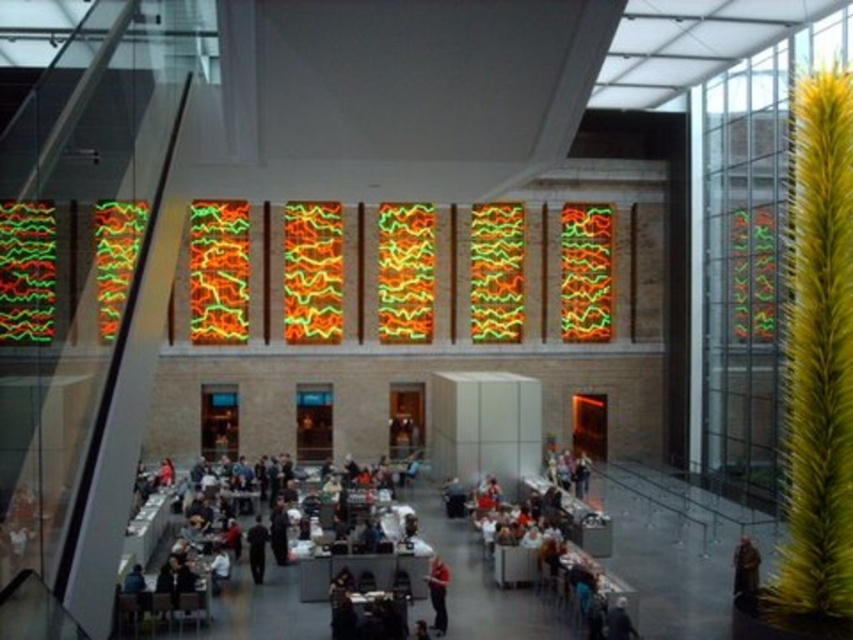
You are a fashion designer observing the indoor atrium scene. You notice a matte orange shirt at center and a dark blue fabric at center. Which object is smaller in size?

The matte orange shirt at center is smaller in size compared to the dark blue fabric at center.

You are standing in the atrium and need to find the dark gray suit at center. According to the layout, where would you look relative to the seven vertical panels?

The dark gray suit at center is located at point coordinates relative to the seven vertical panels, but since the exact spatial relationship isn not provided in the Objects Description, the answer cannot be determined from the given information. However, based on the Scene description, the panels are along the back wall, so the suit might be positioned in the central area of the atrium away from the back wall.

You are standing in the atrium and see the dark gray suit at center. If you want to reach it quickly, should you walk straight ahead or turn left?

The dark gray suit at center is 24.74 meters away from the viewer, so walking straight ahead would be the most direct path to reach it quickly.